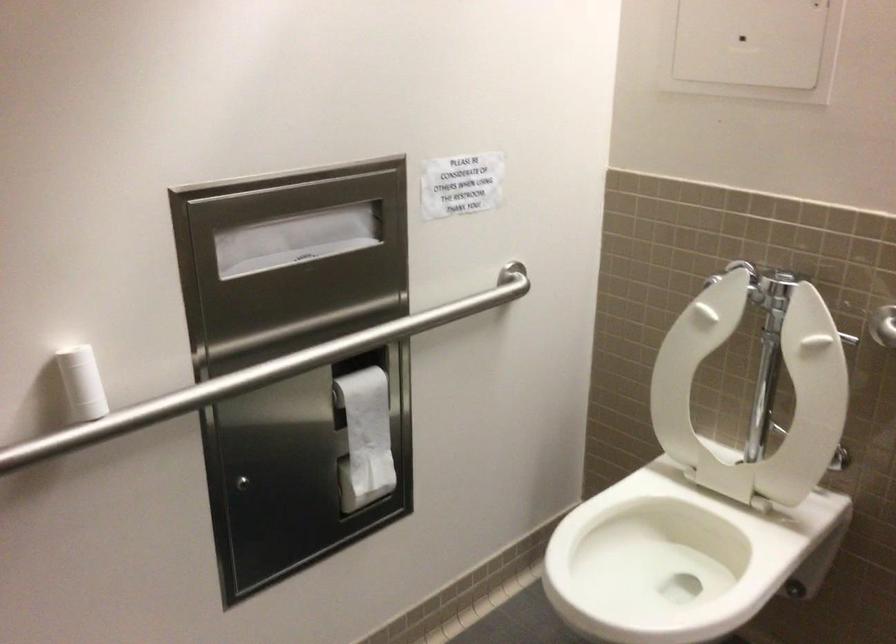
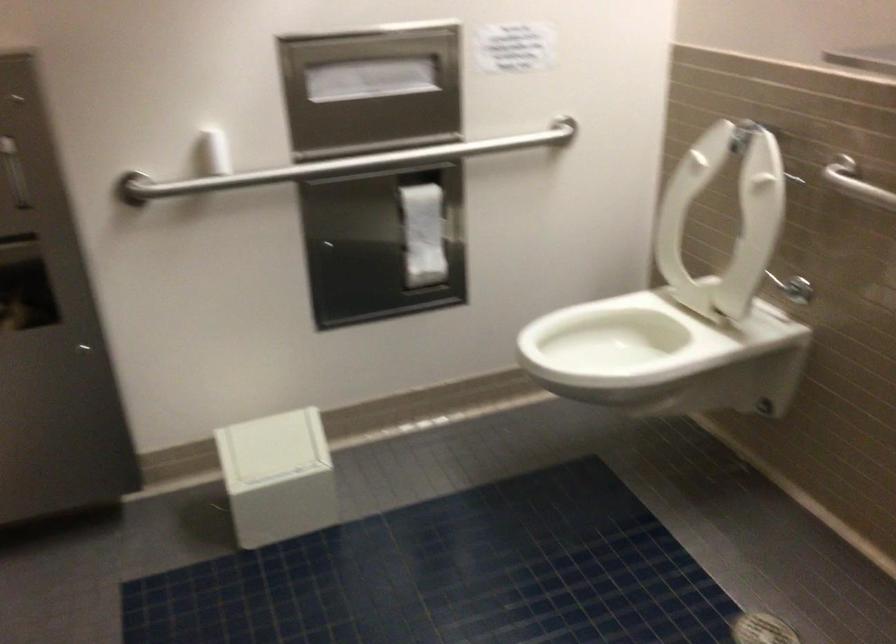
The point at [88,386] is marked in the first image. Where is the corresponding point in the second image?

(213, 152)